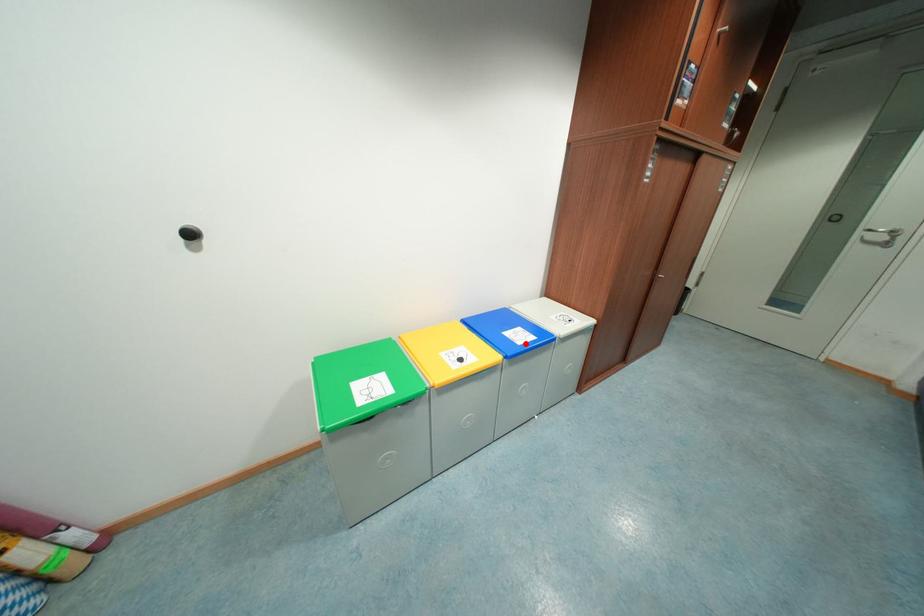
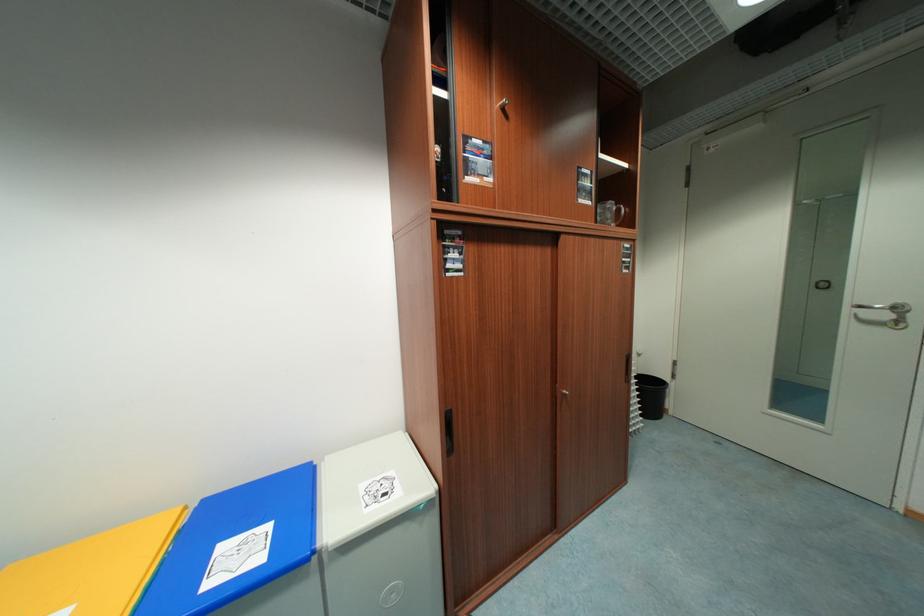
Locate, in the second image, the point that corresponds to the highlighted location in the first image.

(211, 588)